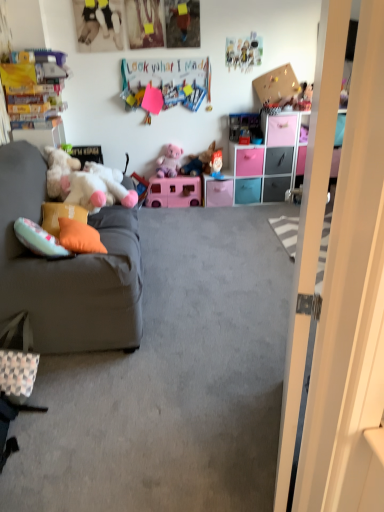
This screenshot has width=384, height=512. In order to click on free location to the left of white glossy door at right in this screenshot , I will do `click(188, 442)`.